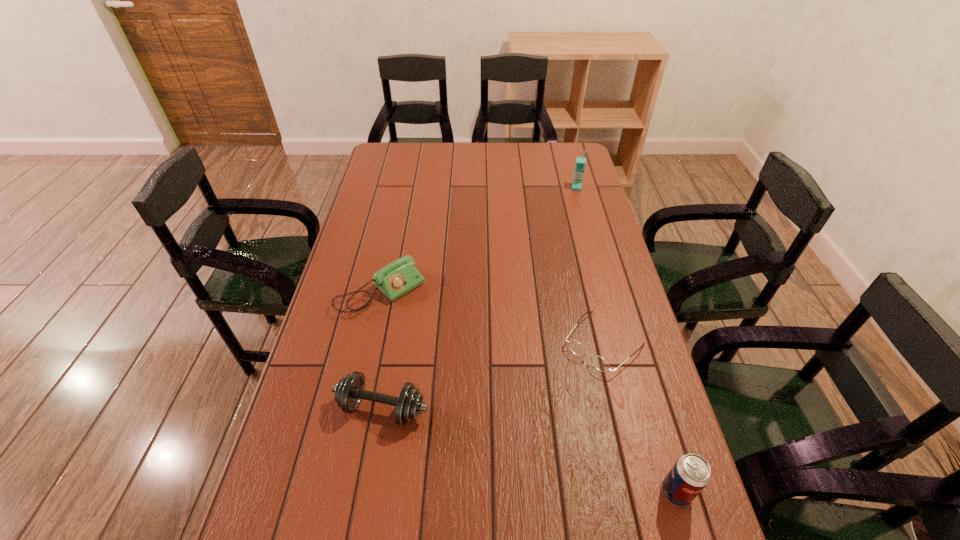
Find the location of a particular element. Image resolution: width=960 pixels, height=540 pixels. vacant space that is in between the dumbbell and the second shortest object is located at coordinates (382, 350).

I want to click on free space between the cellular telephone and the second shortest object, so click(x=479, y=239).

Image resolution: width=960 pixels, height=540 pixels. Identify the location of object that stands as the second closest to the shortest object. (349, 391).

Where is `the fourth closest object to the third shortest object`? Image resolution: width=960 pixels, height=540 pixels. the fourth closest object to the third shortest object is located at coordinates (580, 161).

Image resolution: width=960 pixels, height=540 pixels. In order to click on vacant space that satisfies the following two spatial constraints: 1. on the front side of the second shortest object; 2. on the left side of the shortest object in this screenshot , I will do `click(371, 343)`.

This screenshot has height=540, width=960. In order to click on vacant region that satisfies the following two spatial constraints: 1. on the front side of the second tallest object; 2. on the left side of the second nearest object in this screenshot , I will do `click(369, 492)`.

The width and height of the screenshot is (960, 540). I want to click on vacant space that satisfies the following two spatial constraints: 1. on the back side of the shortest object; 2. on the left side of the farthest object, so click(x=566, y=187).